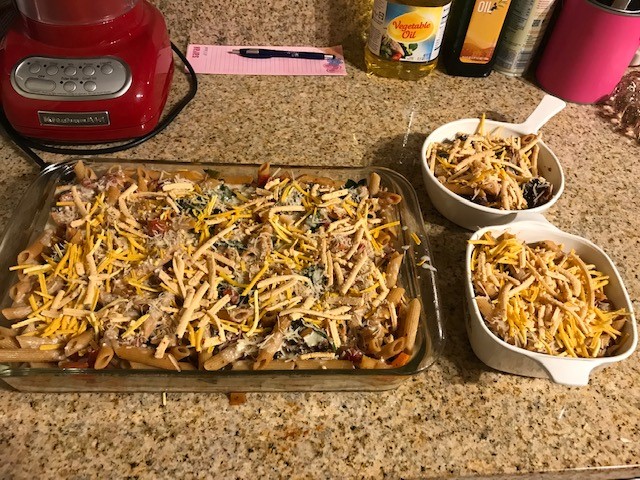
At what (x,y) coordinates should I click in order to perform the action: click on bottles. Please return your answer as a coordinate pair (x, y). Image resolution: width=640 pixels, height=480 pixels. Looking at the image, I should click on (399, 39), (477, 33), (532, 24).